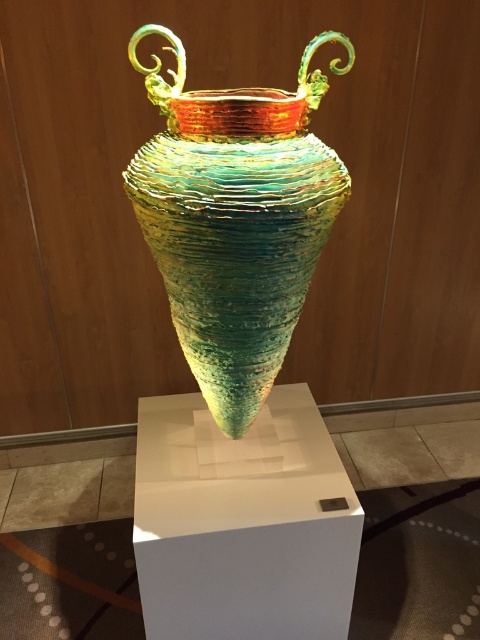
Question: Does translucent glass vase at center have a smaller size compared to white matte pedestal at center?

Choices:
 (A) no
 (B) yes

Answer: (B)

Question: Is translucent glass vase at center above white matte pedestal at center?

Choices:
 (A) no
 (B) yes

Answer: (B)

Question: Which object is farther from the camera taking this photo?

Choices:
 (A) translucent glass vase at center
 (B) white matte pedestal at center

Answer: (B)

Question: Does translucent glass vase at center have a larger size compared to white matte pedestal at center?

Choices:
 (A) no
 (B) yes

Answer: (A)

Question: Which point is farther from the camera taking this photo?

Choices:
 (A) (154, 90)
 (B) (268, 472)

Answer: (B)